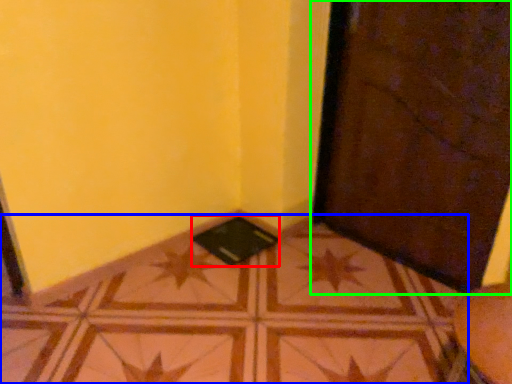
Question: Which object is the farthest from pad (highlighted by a red box)? Choose among these: tile (highlighted by a blue box) or door (highlighted by a green box).

Choices:
 (A) tile
 (B) door

Answer: (B)